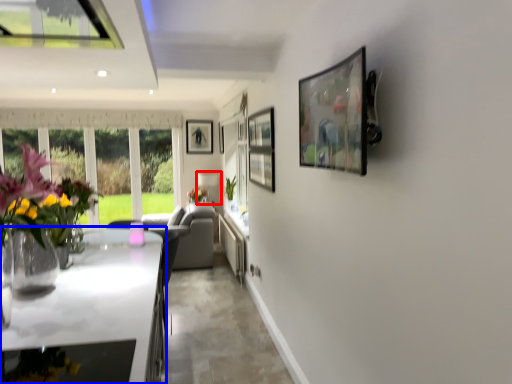
Question: Which point is closer to the camera, lamp (highlighted by a red box) or countertop (highlighted by a blue box)?

Choices:
 (A) lamp
 (B) countertop

Answer: (B)